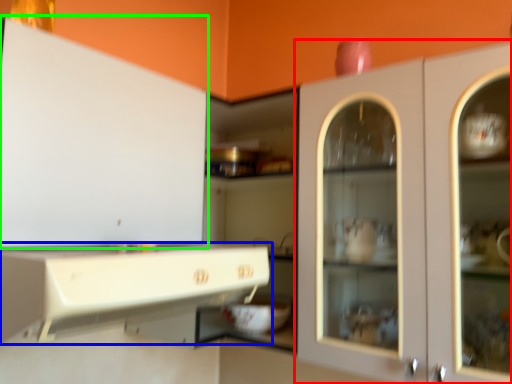
Question: Which object is positioned farthest from cabinetry (highlighted by a red box)? Select from cabinetry (highlighted by a blue box) and cabinetry (highlighted by a green box).

Choices:
 (A) cabinetry
 (B) cabinetry

Answer: (B)